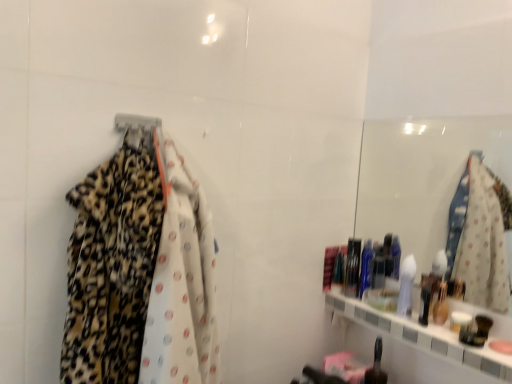
Question: Can you confirm if leopard print fabric at left is bigger than metallic silver hanger at upper left?

Choices:
 (A) yes
 (B) no

Answer: (A)

Question: Is leopard print fabric at left shorter than metallic silver hanger at upper left?

Choices:
 (A) no
 (B) yes

Answer: (A)

Question: From the image's perspective, is leopard print fabric at left over metallic silver hanger at upper left?

Choices:
 (A) no
 (B) yes

Answer: (A)

Question: From a real-world perspective, is leopard print fabric at left physically below metallic silver hanger at upper left?

Choices:
 (A) no
 (B) yes

Answer: (B)

Question: Could you tell me if leopard print fabric at left is facing metallic silver hanger at upper left?

Choices:
 (A) no
 (B) yes

Answer: (A)

Question: From the image's perspective, relative to shiny black bottle at lower center, the 2th toiletry in the top-to-bottom sequence, is metallic silver hanger at upper left above or below?

Choices:
 (A) below
 (B) above

Answer: (B)

Question: Looking at the image, does metallic silver hanger at upper left seem bigger or smaller compared to shiny black bottle at lower center, positioned as the 1th toiletry in bottom-to-top order?

Choices:
 (A) big
 (B) small

Answer: (B)

Question: Based on their positions, is metallic silver hanger at upper left located to the left or right of shiny black bottle at lower center, the 2th toiletry from the back?

Choices:
 (A) left
 (B) right

Answer: (A)

Question: Considering the positions of point (121, 122) and point (384, 380), is point (121, 122) closer or farther from the camera than point (384, 380)?

Choices:
 (A) closer
 (B) farther

Answer: (A)

Question: Does point (130, 127) appear closer or farther from the camera than point (180, 193)?

Choices:
 (A) closer
 (B) farther

Answer: (B)

Question: In the image, is metallic silver hanger at upper left on the left side or the right side of leopard print fabric at left?

Choices:
 (A) right
 (B) left

Answer: (B)

Question: From their relative heights in the image, would you say metallic silver hanger at upper left is taller or shorter than leopard print fabric at left?

Choices:
 (A) short
 (B) tall

Answer: (A)

Question: From a real-world perspective, is metallic silver hanger at upper left above or below leopard print fabric at left?

Choices:
 (A) above
 (B) below

Answer: (A)

Question: Would you say shiny plastic container at right, which is the 1th toiletry in back-to-front order, is to the left or to the right of metallic silver hanger at upper left in the picture?

Choices:
 (A) right
 (B) left

Answer: (A)

Question: Is shiny plastic container at right, which is the 1th toiletry in back-to-front order, inside the boundaries of metallic silver hanger at upper left, or outside?

Choices:
 (A) inside
 (B) outside

Answer: (B)